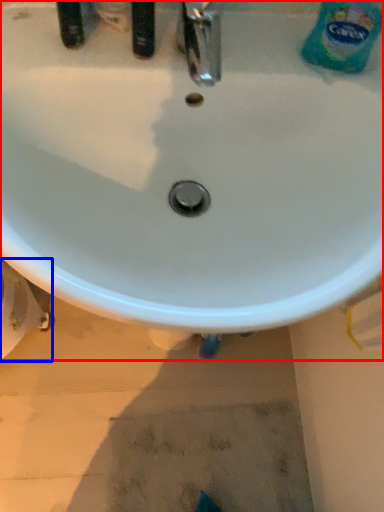
Question: Which object is further to the camera taking this photo, sink (highlighted by a red box) or bidet (highlighted by a blue box)?

Choices:
 (A) sink
 (B) bidet

Answer: (B)